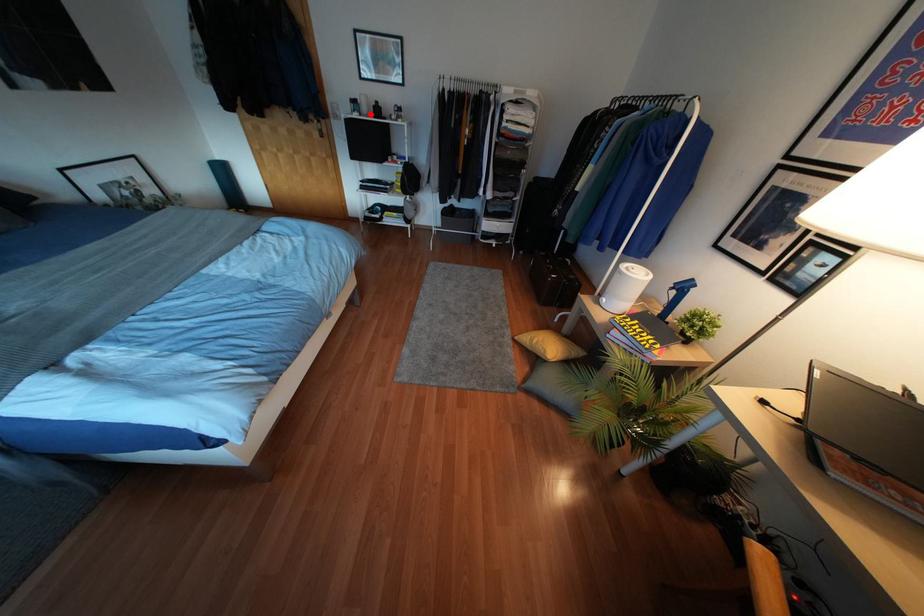
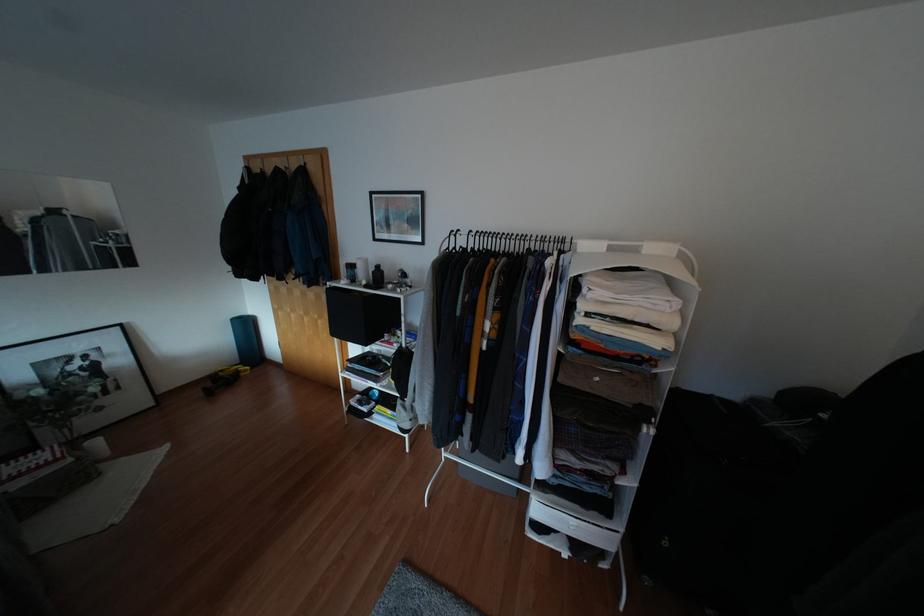
Find the pixel in the second image that matches the highlighted location in the first image.

(362, 282)